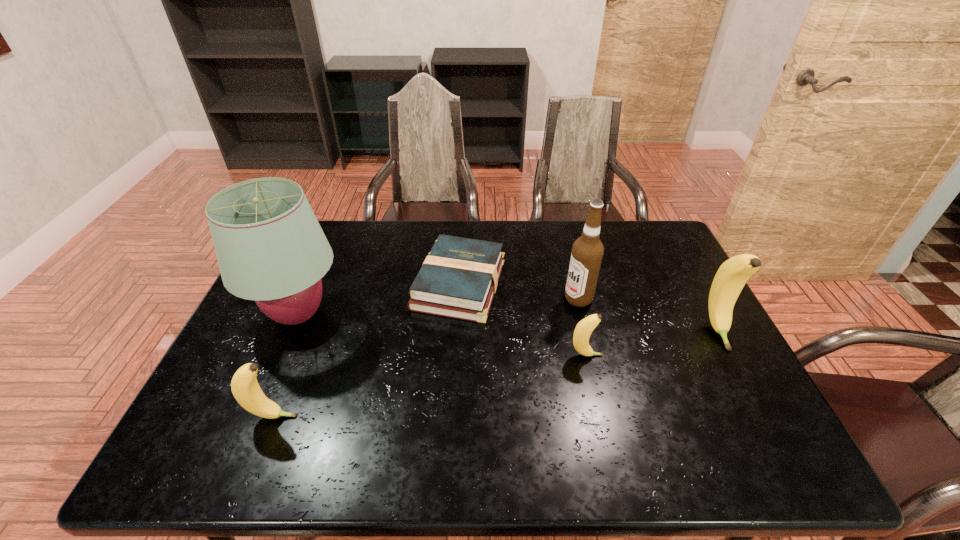
The image size is (960, 540). What are the coordinates of `free space for an extra banana to achieve even spacing` in the screenshot? It's located at (440, 384).